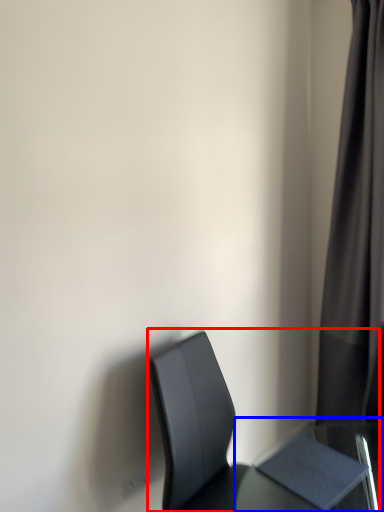
Question: Among these objects, which one is farthest to the camera, chair (highlighted by a red box) or table (highlighted by a blue box)?

Choices:
 (A) chair
 (B) table

Answer: (B)